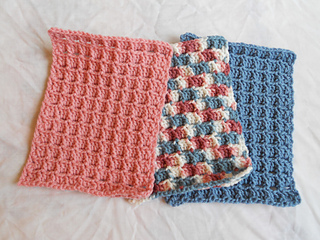
In order to click on upper white bedding in this screenshot , I will do `click(164, 11)`.